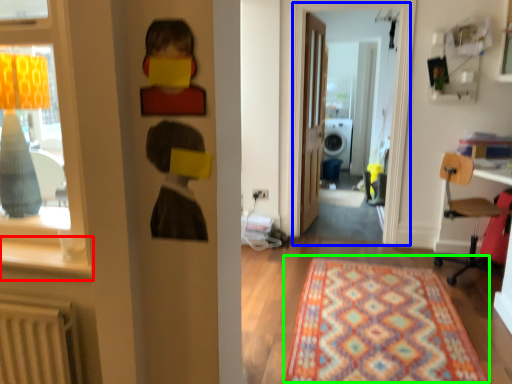
Question: Considering the real-world distances, which object is farthest from window sill (highlighted by a red box)? window screen (highlighted by a blue box) or mat (highlighted by a green box)?

Choices:
 (A) window screen
 (B) mat

Answer: (A)